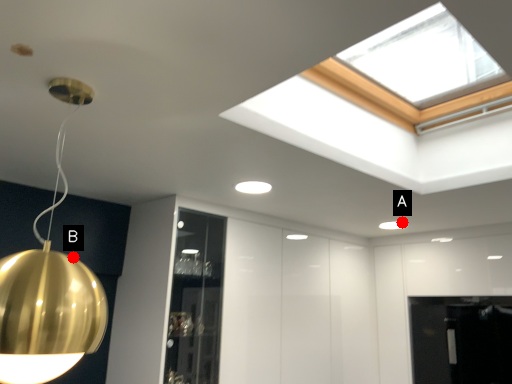
Question: Two points are circled on the image, labeled by A and B beside each circle. Among these points, which one is nearest to the camera?

Choices:
 (A) A is closer
 (B) B is closer

Answer: (B)